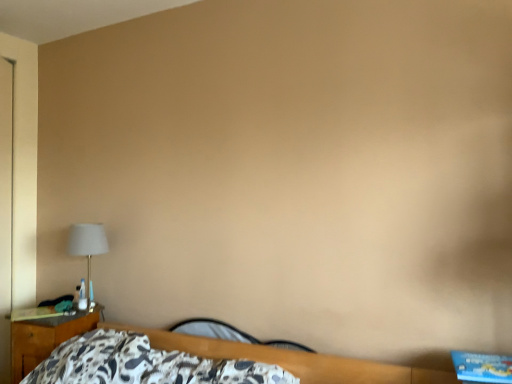
Question: Does matte white lampshade at left appear on the right side of wooden nightstand at left?

Choices:
 (A) yes
 (B) no

Answer: (A)

Question: Is matte white lampshade at left turned away from wooden nightstand at left?

Choices:
 (A) yes
 (B) no

Answer: (B)

Question: Is the depth of matte white lampshade at left less than that of wooden nightstand at left?

Choices:
 (A) yes
 (B) no

Answer: (B)

Question: Is matte white lampshade at left placed right next to wooden nightstand at left?

Choices:
 (A) yes
 (B) no

Answer: (B)

Question: From the image's perspective, is matte white lampshade at left under wooden nightstand at left?

Choices:
 (A) yes
 (B) no

Answer: (B)

Question: From the image's perspective, is matte white lampshade at left over wooden nightstand at left?

Choices:
 (A) no
 (B) yes

Answer: (B)

Question: From the image's perspective, would you say black leather guitar at lower center is positioned over wooden nightstand at left?

Choices:
 (A) no
 (B) yes

Answer: (B)

Question: From a real-world perspective, is black leather guitar at lower center under wooden nightstand at left?

Choices:
 (A) yes
 (B) no

Answer: (B)

Question: Is black leather guitar at lower center oriented away from wooden nightstand at left?

Choices:
 (A) yes
 (B) no

Answer: (B)

Question: Is black leather guitar at lower center outside of wooden nightstand at left?

Choices:
 (A) no
 (B) yes

Answer: (B)

Question: Considering the relative positions of black leather guitar at lower center and wooden nightstand at left in the image provided, is black leather guitar at lower center to the left of wooden nightstand at left from the viewer's perspective?

Choices:
 (A) yes
 (B) no

Answer: (B)

Question: Can you confirm if black leather guitar at lower center is taller than wooden nightstand at left?

Choices:
 (A) no
 (B) yes

Answer: (A)

Question: Would you say matte white lampshade at left is part of wooden nightstand at left's contents?

Choices:
 (A) yes
 (B) no

Answer: (B)